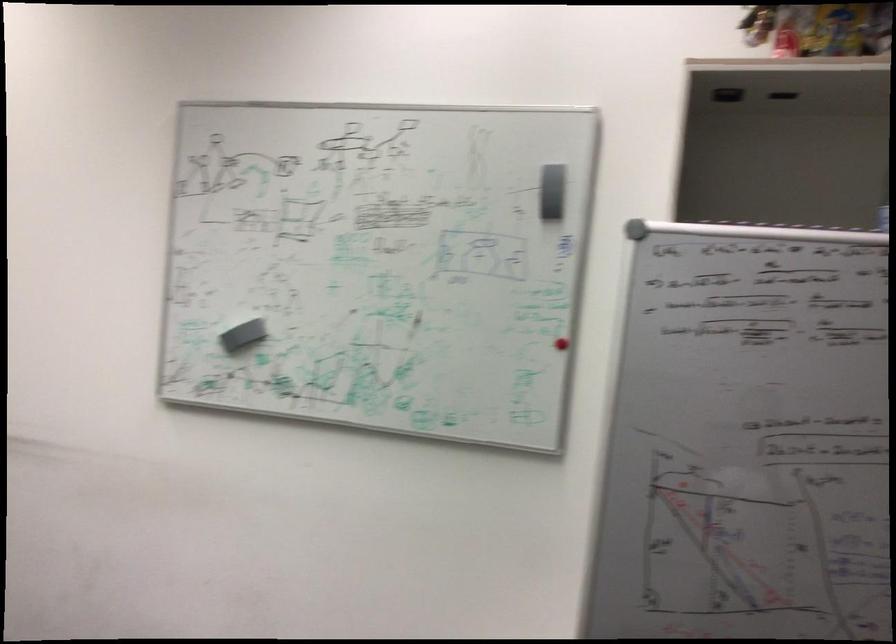
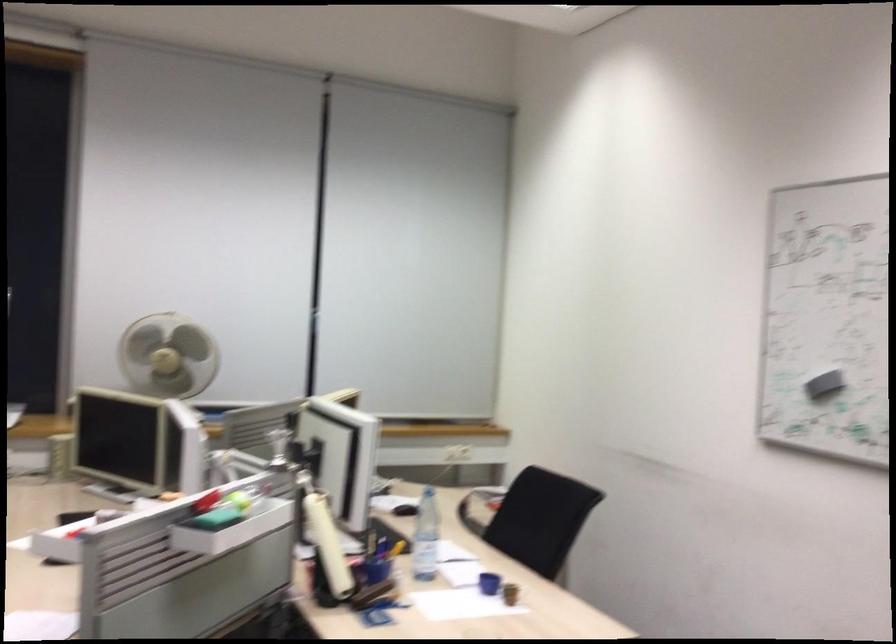
Question: The camera is either moving clockwise (left) or counter-clockwise (right) around the object. The first image is from the beginning of the video and the second image is from the end. Is the camera moving left or right when shooting the video?

Choices:
 (A) Left
 (B) Right

Answer: (B)